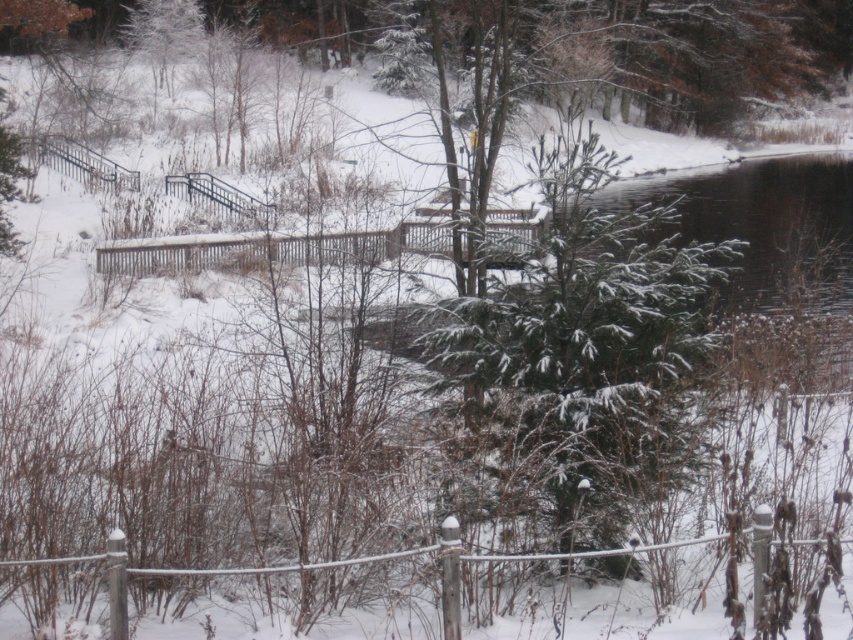
Between green textured evergreen tree at center and wooden fence at center, which one has less height?

wooden fence at center

Image resolution: width=853 pixels, height=640 pixels. What do you see at coordinates (590, 346) in the screenshot?
I see `green textured evergreen tree at center` at bounding box center [590, 346].

The width and height of the screenshot is (853, 640). What do you see at coordinates (590, 346) in the screenshot?
I see `green textured evergreen tree at center` at bounding box center [590, 346].

You are a GUI agent. You are given a task and a screenshot of the screen. Output one action in this format:
    pyautogui.click(x=<x>, y=<y>)
    Task: Click on the green textured evergreen tree at center
    The width and height of the screenshot is (853, 640).
    Given the screenshot: What is the action you would take?
    pyautogui.click(x=590, y=346)

Is green textured evergreen tree at center bigger than black metal fence at upper left?

Yes, green textured evergreen tree at center is bigger than black metal fence at upper left.

Can you confirm if green textured evergreen tree at center is taller than black metal fence at upper left?

Correct, green textured evergreen tree at center is much taller as black metal fence at upper left.

Describe the element at coordinates (590, 346) in the screenshot. I see `green textured evergreen tree at center` at that location.

This screenshot has height=640, width=853. Find the location of `green textured evergreen tree at center`. green textured evergreen tree at center is located at coordinates (590, 346).

Consider the image. Is wooden fence at center to the left of white wooden fence at center from the viewer's perspective?

Indeed, wooden fence at center is positioned on the left side of white wooden fence at center.

Who is more forward, (503, 243) or (218, 570)?

Point (218, 570) is in front.

The height and width of the screenshot is (640, 853). I want to click on wooden fence at center, so click(282, 248).